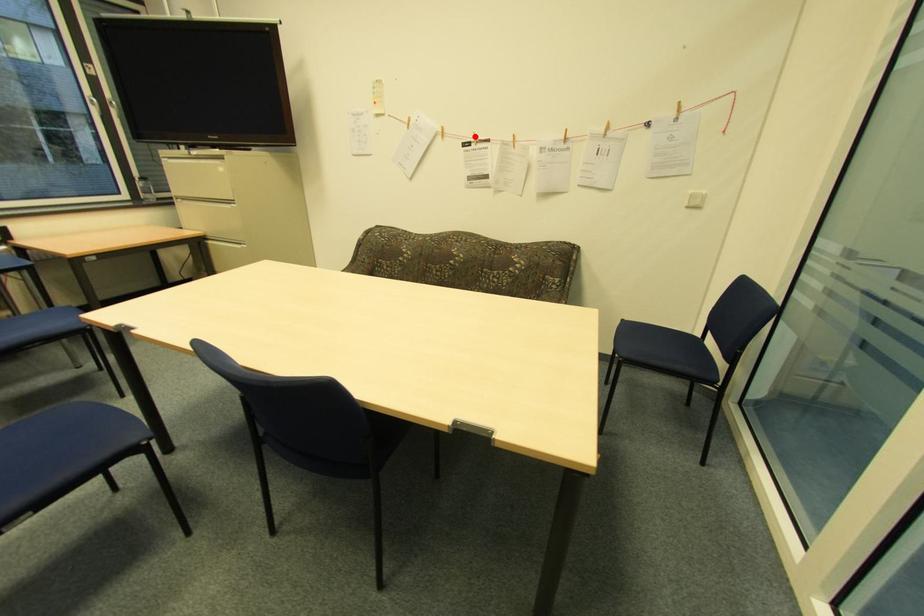
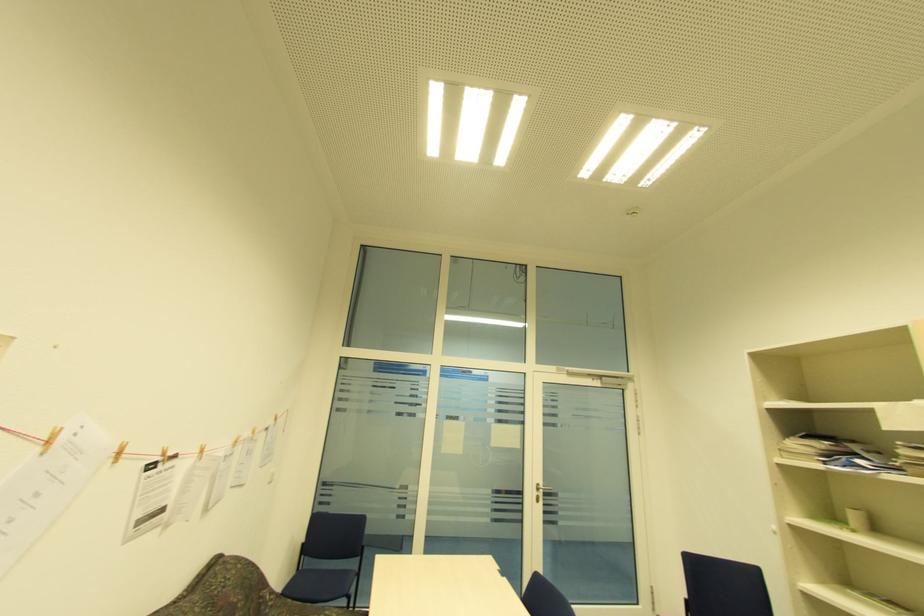
Where in the second image is the point corresponding to the highlighted location from the first image?

(163, 454)